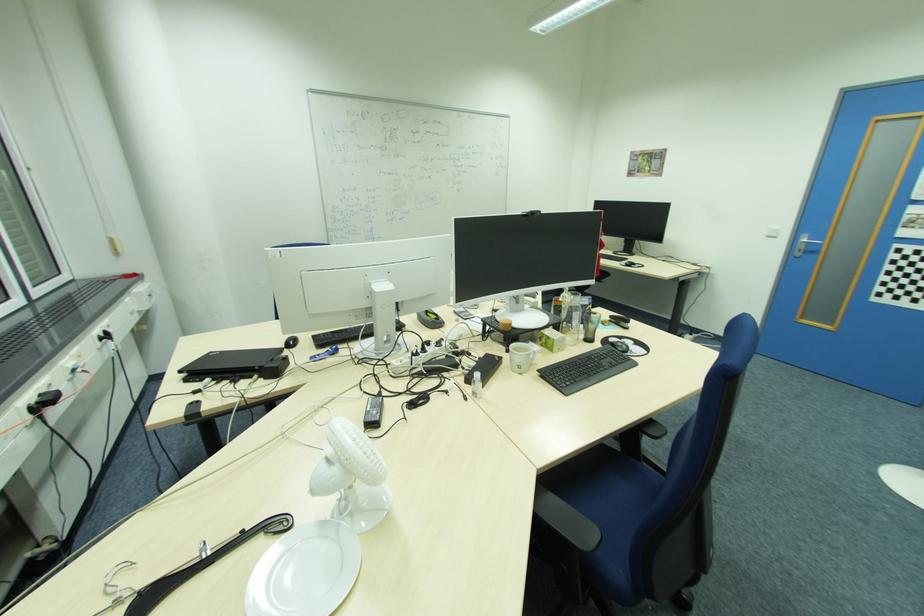
I want to click on chair sitting surface, so click(x=616, y=483).